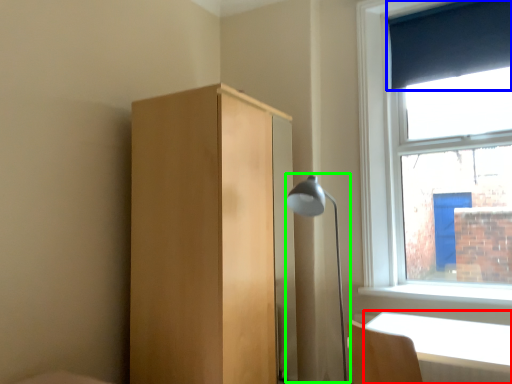
Question: Estimate the real-world distances between objects in this image. Which object is farther from table (highlighted by a red box), curtain (highlighted by a blue box) or lamp (highlighted by a green box)?

Choices:
 (A) curtain
 (B) lamp

Answer: (A)